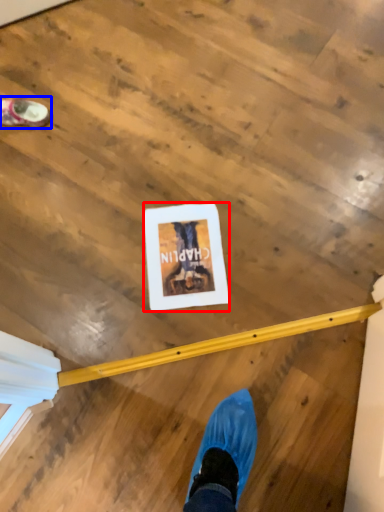
Question: Which object is further to the camera taking this photo, postcard (highlighted by a red box) or footwear (highlighted by a blue box)?

Choices:
 (A) postcard
 (B) footwear

Answer: (B)